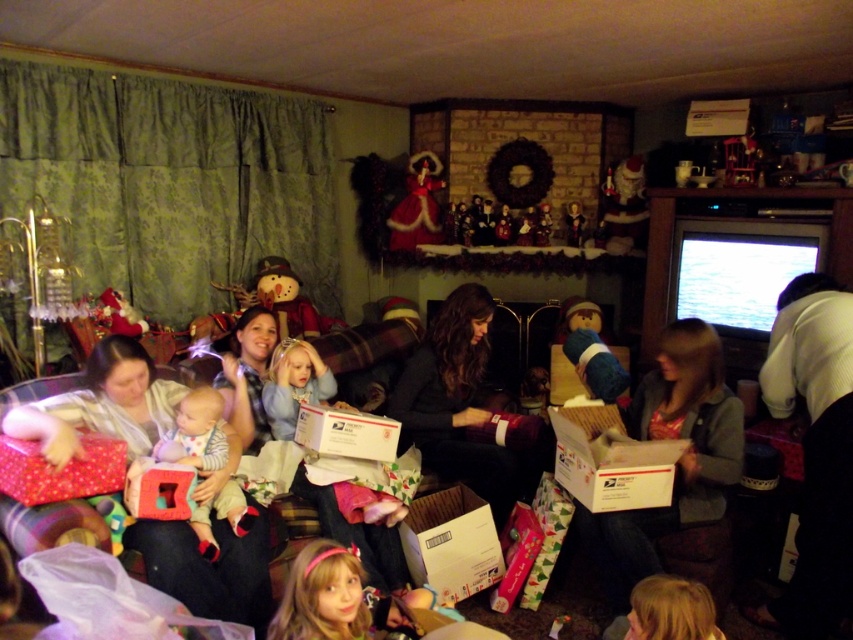
The width and height of the screenshot is (853, 640). Identify the location of soft cotton onesie at center. (195, 433).

Locate an element on the screen. The image size is (853, 640). soft cotton onesie at center is located at coordinates (195, 433).

Does fuzzy plush santa at upper center come behind velvet plush snowman at center?

Yes.

At what (x,y) coordinates should I click in order to perform the action: click on fuzzy plush santa at upper center. Please return your answer as a coordinate pair (x, y). Looking at the image, I should click on (624, 208).

I want to click on fuzzy plush santa at upper center, so click(624, 208).

Does velvet plush snowman at center appear on the left side of shiny silver ornament at upper center?

Correct, you'll find velvet plush snowman at center to the left of shiny silver ornament at upper center.

Between velvet plush snowman at center and shiny silver ornament at upper center, which one is positioned higher?

shiny silver ornament at upper center is above.

Between point (112, 323) and point (538, 214), which one is positioned behind?

Point (538, 214)

Locate an element on the screen. This screenshot has height=640, width=853. velvet plush snowman at center is located at coordinates (120, 314).